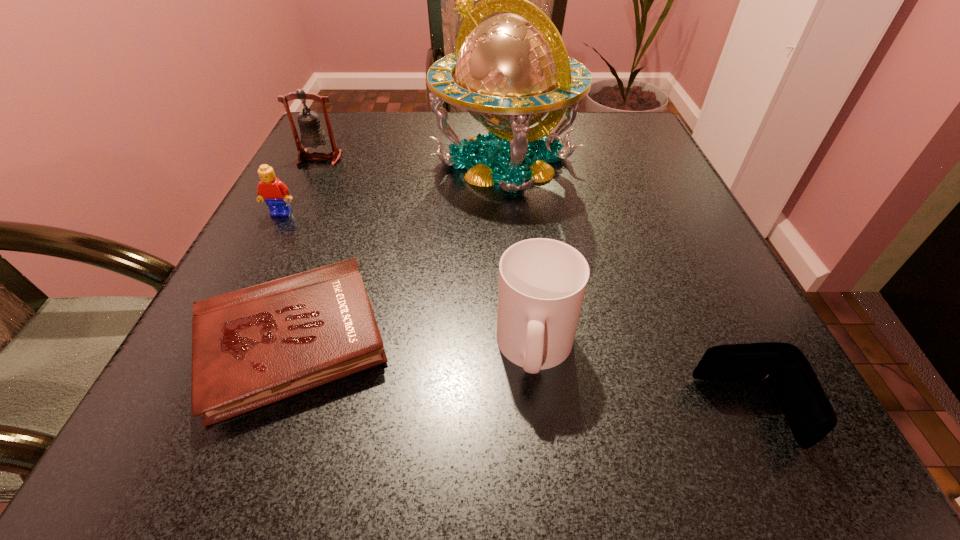
In the image, there is a desktop. Where is `vacant area at the right edge`? This screenshot has width=960, height=540. vacant area at the right edge is located at coordinates 764,399.

Where is `free location at the near left corner`? free location at the near left corner is located at coordinates (262, 424).

The width and height of the screenshot is (960, 540). I want to click on free space between the mug and the second shortest object, so click(x=640, y=380).

Image resolution: width=960 pixels, height=540 pixels. What are the coordinates of `free space between the fifth tallest object and the hardback book` in the screenshot? It's located at (519, 378).

This screenshot has width=960, height=540. I want to click on free area in between the bell and the globe, so click(413, 160).

This screenshot has height=540, width=960. What are the coordinates of `free space between the globe and the wallet` in the screenshot? It's located at (625, 287).

Where is `free spot between the tallest object and the shortest object`? free spot between the tallest object and the shortest object is located at coordinates (399, 252).

The height and width of the screenshot is (540, 960). Find the location of `empty location between the hardback book and the mug`. empty location between the hardback book and the mug is located at coordinates (415, 346).

This screenshot has width=960, height=540. Identify the location of the fifth closest object to the hardback book. (810, 415).

Find the location of a particular element. The height and width of the screenshot is (540, 960). object that stands as the third closest to the tallest object is located at coordinates (275, 193).